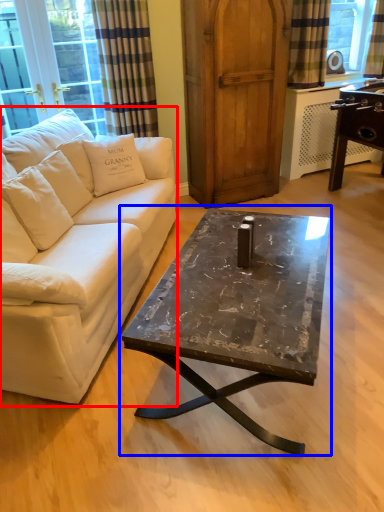
Question: Among these objects, which one is farthest to the camera, studio couch (highlighted by a red box) or coffee table (highlighted by a blue box)?

Choices:
 (A) studio couch
 (B) coffee table

Answer: (B)